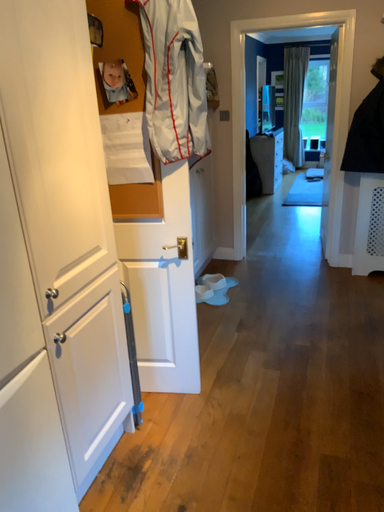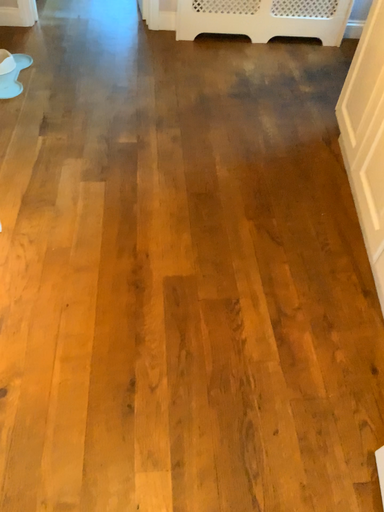
Question: How did the camera likely rotate when shooting the video?

Choices:
 (A) rotated upward
 (B) rotated downward

Answer: (B)